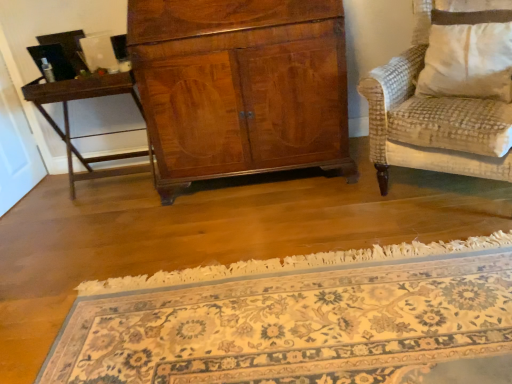
Where is `free space on the front side of dark brown wood table at left`? free space on the front side of dark brown wood table at left is located at coordinates (105, 221).